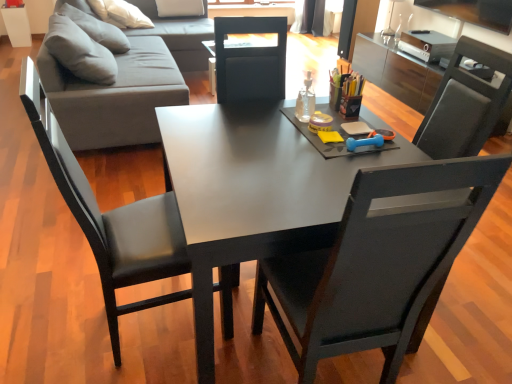
Find the location of `free spot in front of transparent glass bottle at center`. free spot in front of transparent glass bottle at center is located at coordinates [x=327, y=133].